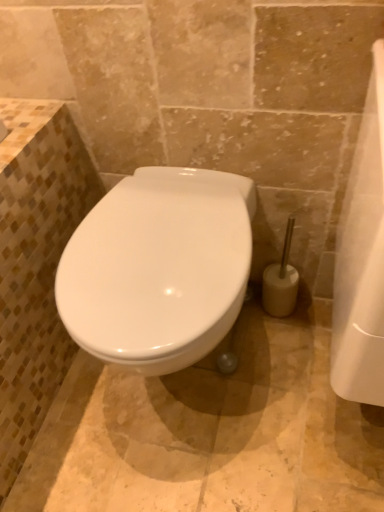
What is the approximate height of white glossy toilet at center?

white glossy toilet at center is 18.87 inches in height.

This screenshot has height=512, width=384. In order to click on white glossy toilet at center in this screenshot , I will do `click(159, 268)`.

This screenshot has height=512, width=384. Describe the element at coordinates (159, 268) in the screenshot. I see `white glossy toilet at center` at that location.

You are a GUI agent. You are given a task and a screenshot of the screen. Output one action in this format:
    pyautogui.click(x=<x>, y=<y>)
    Task: Click on the white glossy toilet at center
    The height and width of the screenshot is (512, 384).
    Given the screenshot: What is the action you would take?
    pyautogui.click(x=159, y=268)